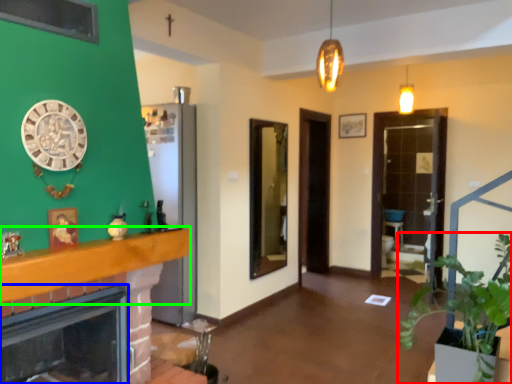
Question: Which object is the farthest from houseplant (highlighted by a red box)? Choose among these: fireplace (highlighted by a blue box) or balustrade (highlighted by a green box).

Choices:
 (A) fireplace
 (B) balustrade

Answer: (A)